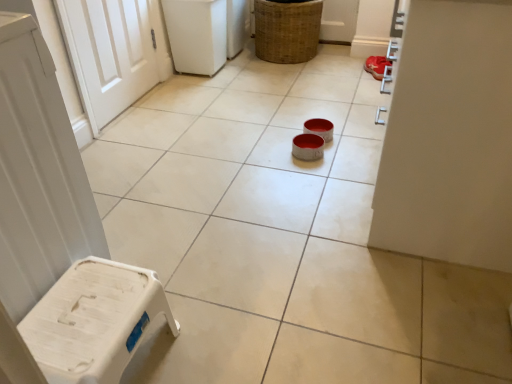
At what (x,y) coordinates should I click in order to perform the action: click on vacant area that is in front of red suede shoe at upper right. Please return your answer as a coordinate pair (x, y). Looking at the image, I should click on point(362,89).